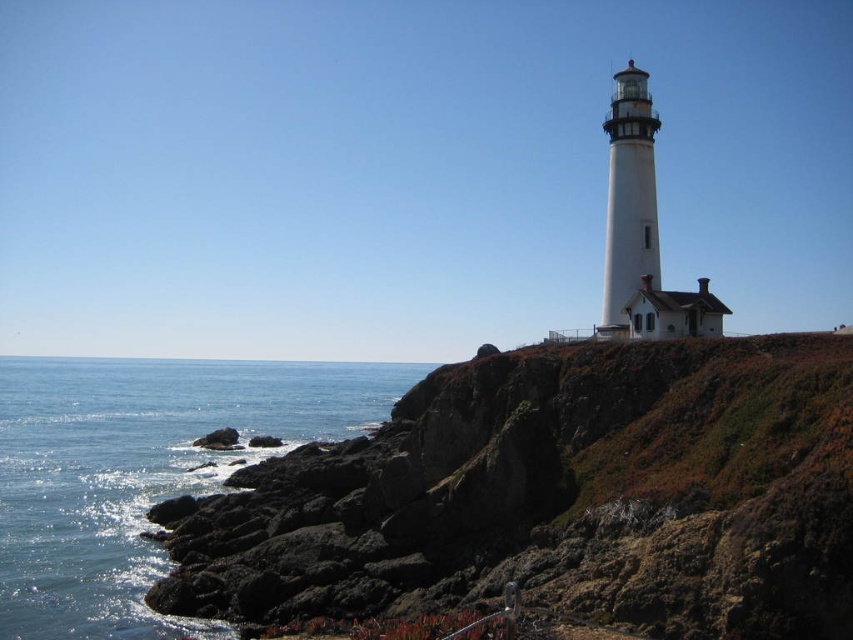
Question: Among these points, which one is farthest from the camera?

Choices:
 (A) (122, 365)
 (B) (743, 502)

Answer: (A)

Question: Does rough volcanic rock at center have a greater width compared to blue water at lower left?

Choices:
 (A) no
 (B) yes

Answer: (A)

Question: Does rough volcanic rock at center have a lesser width compared to blue water at lower left?

Choices:
 (A) yes
 (B) no

Answer: (A)

Question: Is rough volcanic rock at center below blue water at lower left?

Choices:
 (A) no
 (B) yes

Answer: (A)